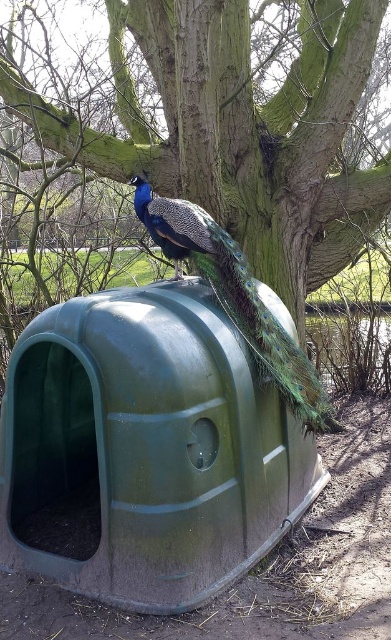
Who is more forward, (247, 173) or (285, 344)?

Point (285, 344)

Is the position of green plastic tree at upper center less distant than that of shiny blue-green peacock at center?

That is False.

Measure the distance between point (136, 148) and camera.

The distance of point (136, 148) from camera is 5.70 meters.

Where is `green plastic tree at upper center`? green plastic tree at upper center is located at coordinates (240, 131).